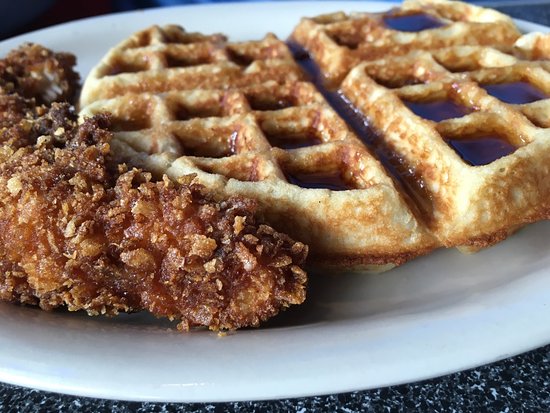
Identify the location of counter top. Image resolution: width=550 pixels, height=413 pixels. (496, 401).